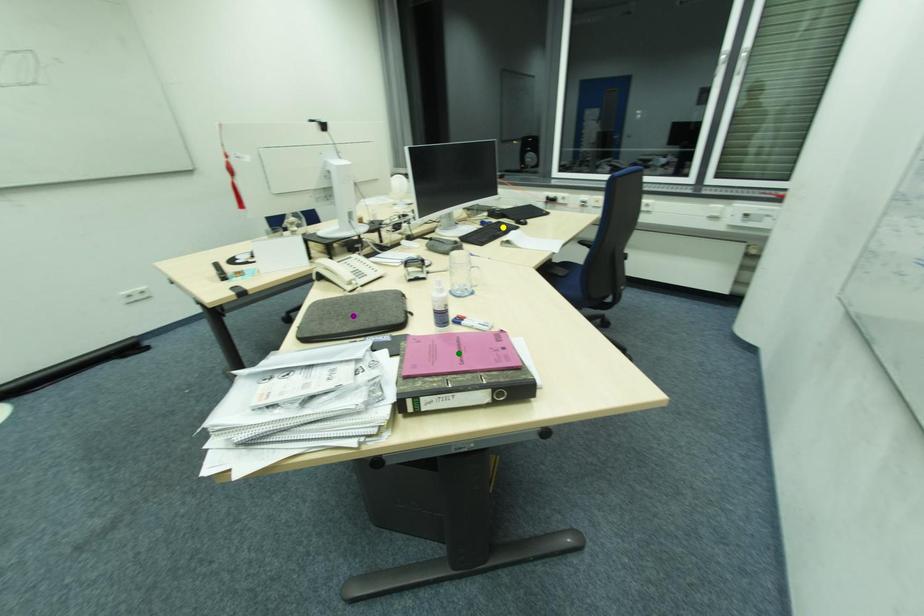
Order these from nearest to farthest:
yellow point
green point
purple point

green point < purple point < yellow point